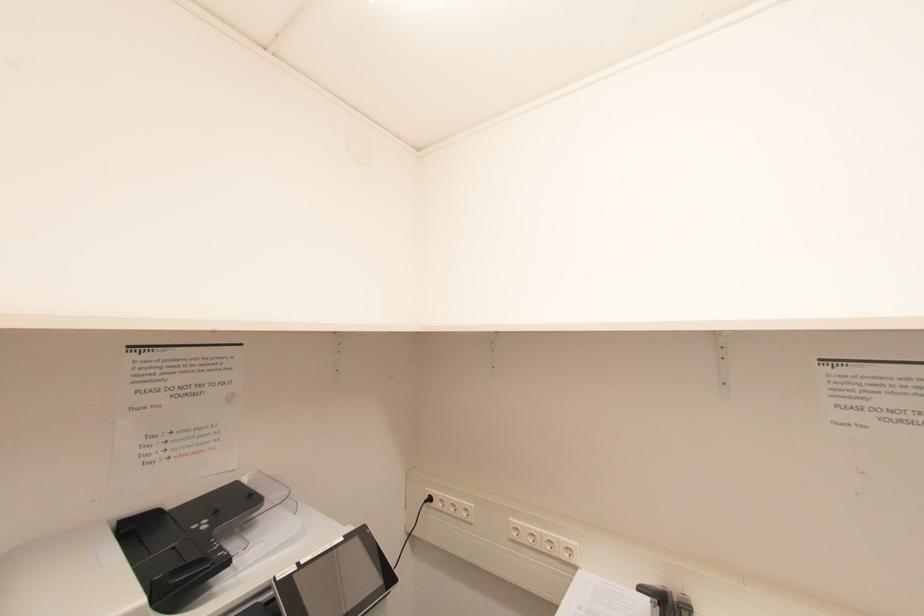
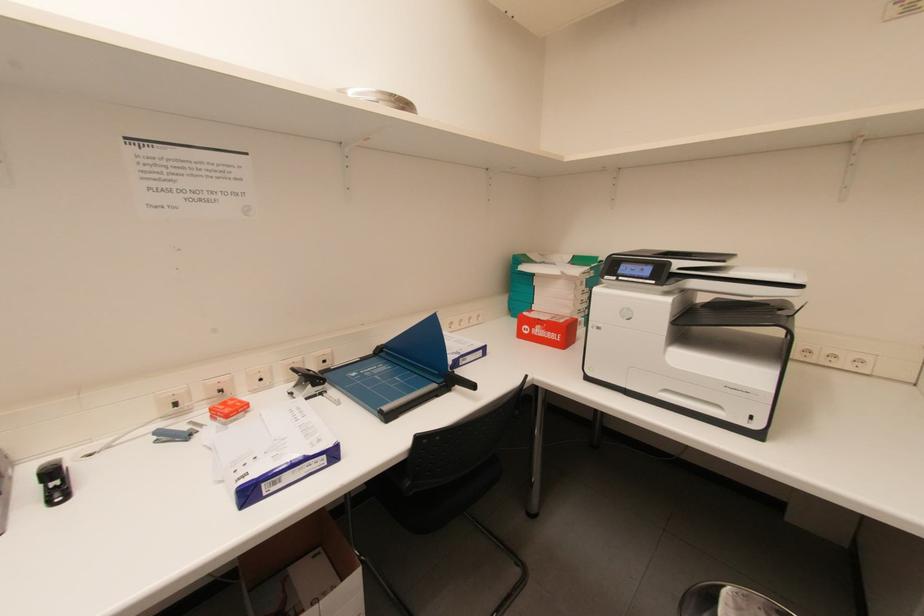
Question: The images are taken continuously from a first-person perspective. In which direction is your viewpoint rotating?

Choices:
 (A) Left
 (B) Right
 (C) Up
 (D) Down

Answer: (B)